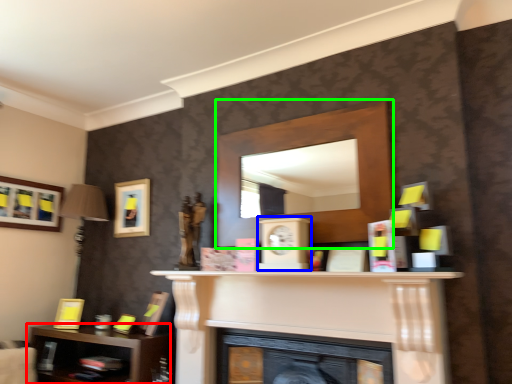
Question: Which is farther away from shelf (highlighted by a red box)? clock (highlighted by a blue box) or shelf (highlighted by a green box)?

Choices:
 (A) clock
 (B) shelf

Answer: (A)